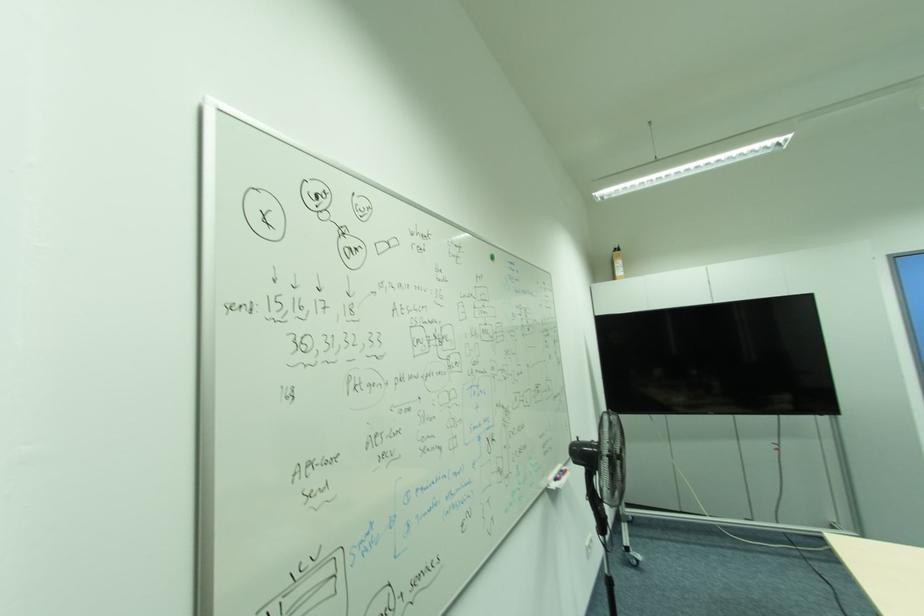
Locate an element on the screen. This screenshot has height=616, width=924. green round magnet is located at coordinates (494, 254).